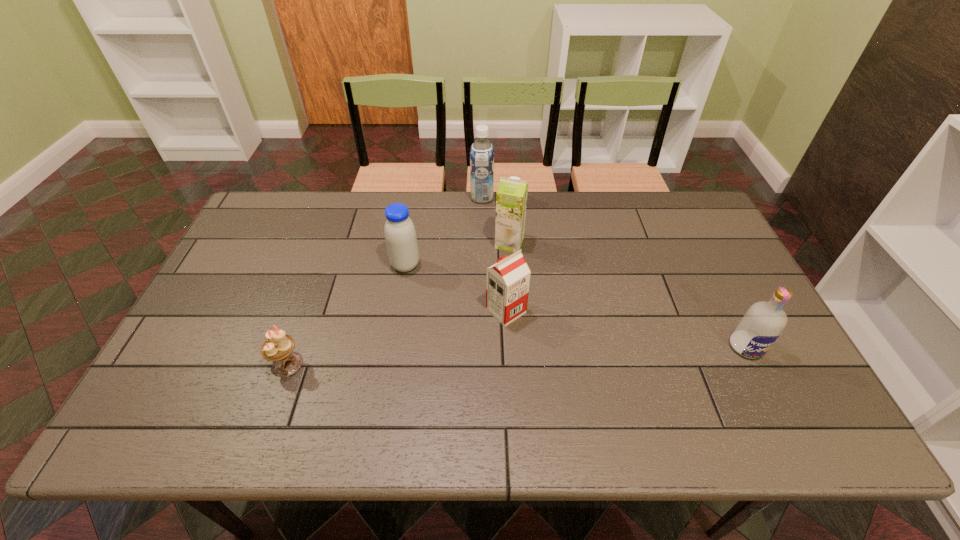
Where is `free region at the right edge of the desktop`? Image resolution: width=960 pixels, height=540 pixels. free region at the right edge of the desktop is located at coordinates (737, 276).

This screenshot has height=540, width=960. I want to click on vacant space at the far left corner, so click(x=276, y=221).

Where is `free spot at the far right corner of the desktop`? This screenshot has width=960, height=540. free spot at the far right corner of the desktop is located at coordinates (666, 192).

The height and width of the screenshot is (540, 960). Identify the location of free space between the farthest soya milk and the fourth farthest object. (494, 254).

In order to click on vacant area between the fifth nearest object and the fourth nearest object in this screenshot , I will do `click(457, 254)`.

You are a GUI agent. You are given a task and a screenshot of the screen. Output one action in this format:
    pyautogui.click(x=<x>, y=<y>)
    Task: Click on the unoccupied area between the rightmost object and the candle holder
    The image size is (960, 540).
    Given the screenshot: What is the action you would take?
    pyautogui.click(x=516, y=356)

Locate an element on the screen. Image resolution: width=960 pixels, height=540 pixels. vacant area between the shortest object and the farthest object is located at coordinates (385, 281).

I want to click on unoccupied area between the farthest object and the shortest object, so click(x=385, y=281).

Locate an element on the screen. empty space between the leftmost soya milk and the farthest object is located at coordinates (444, 231).

Identify the location of vacant space that is in between the third nearest object and the farthest soya milk. This screenshot has width=960, height=540. click(x=494, y=254).